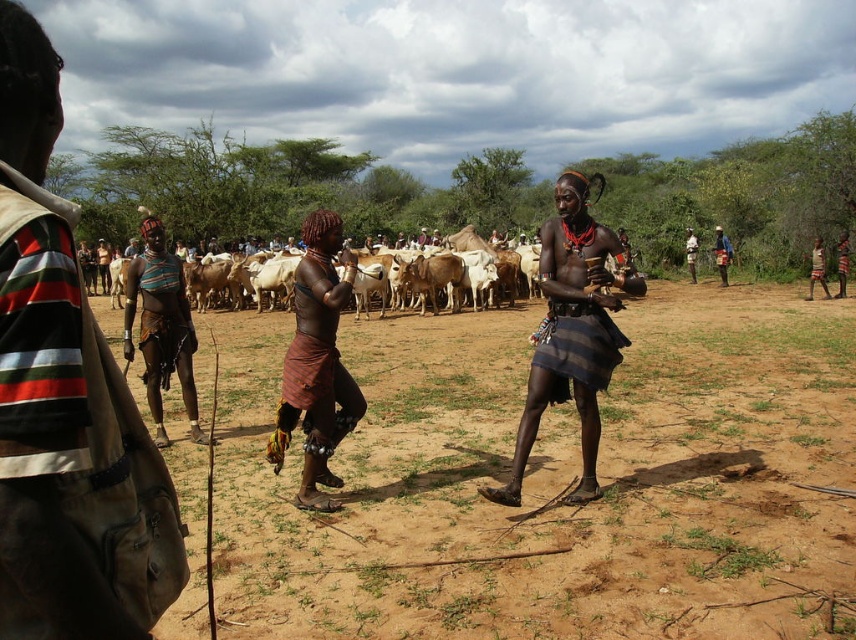
Question: Which point is farther to the camera?

Choices:
 (A) brown sandy ground at center
 (B) matte black skirt at center

Answer: (B)

Question: Among these objects, which one is farthest from the camera?

Choices:
 (A) brown sandy ground at center
 (B) matte black skirt at center
 (C) brown woven skirt at center

Answer: (B)

Question: Considering the relative positions of brown sandy ground at center and brown woven skirt at center in the image provided, where is brown sandy ground at center located with respect to brown woven skirt at center?

Choices:
 (A) right
 (B) left

Answer: (A)

Question: Which point is closer to the camera?

Choices:
 (A) (298, 312)
 (B) (180, 317)

Answer: (A)

Question: Does matte brown leather bag at left have a greater width compared to brown woven skirt at center?

Choices:
 (A) yes
 (B) no

Answer: (B)

Question: Does matte black skirt at center appear on the left side of brown woven skirt at center?

Choices:
 (A) no
 (B) yes

Answer: (A)